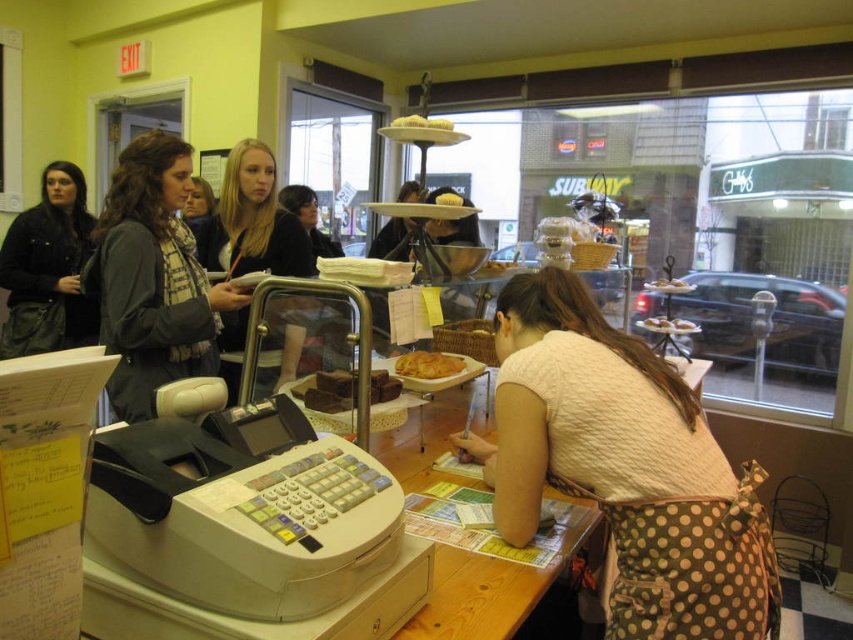
Looking at this image, is white frosted donut at center to the right of white frosted cake at center from the viewer's perspective?

Correct, you'll find white frosted donut at center to the right of white frosted cake at center.

Is point (651, 328) positioned after point (444, 122)?

Yes.

Between point (666, 332) and point (399, 125), which one is positioned behind?

Point (666, 332)

The height and width of the screenshot is (640, 853). Find the location of `white frosted donut at center`. white frosted donut at center is located at coordinates (668, 324).

Is point (323, 385) less distant than point (415, 118)?

Yes, it is.

Is point (346, 404) positioned after point (444, 120)?

No.

You are a GUI agent. You are given a task and a screenshot of the screen. Output one action in this format:
    pyautogui.click(x=<x>, y=<y>)
    Task: Click on the chocolate cake at center
    This screenshot has height=640, width=853.
    Given the screenshot: What is the action you would take?
    pyautogui.click(x=332, y=392)

What do you see at coordinates (421, 122) in the screenshot? This screenshot has width=853, height=640. I see `white frosted cake at center` at bounding box center [421, 122].

Is white frosted cake at center smaller than matte brown bread at center?

No, white frosted cake at center is not smaller than matte brown bread at center.

Locate an element on the screen. white frosted cake at center is located at coordinates (421, 122).